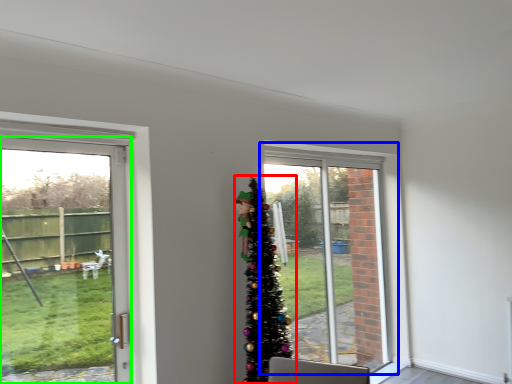
Question: Which object is the closest to the christmas tree (highlighted by a red box)? Choose among these: window (highlighted by a blue box) or door (highlighted by a green box).

Choices:
 (A) window
 (B) door

Answer: (A)